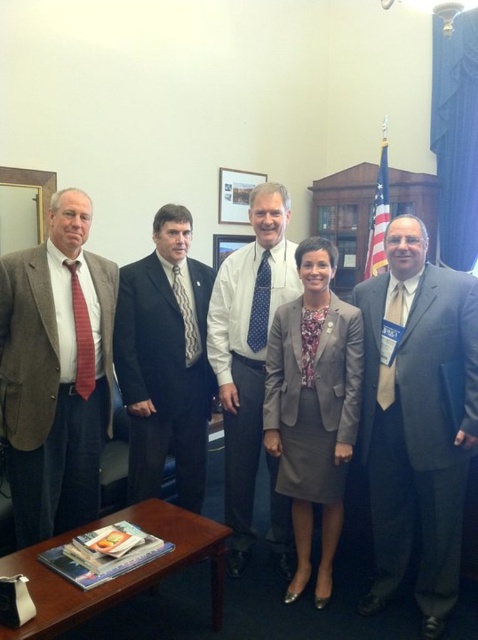
Is matte brown suit at left wider than dark gray suit at center?

Incorrect, matte brown suit at left's width does not surpass dark gray suit at center's.

Can you confirm if matte brown suit at left is positioned below dark gray suit at center?

No, matte brown suit at left is not below dark gray suit at center.

Which is in front, point (21, 305) or point (159, 284)?

Point (21, 305)

Locate an element on the screen. The width and height of the screenshot is (478, 640). matte brown suit at left is located at coordinates (55, 371).

Is point (25, 292) positioned before point (247, 275)?

Yes, point (25, 292) is closer to viewer.

Based on the photo, can you confirm if matte brown suit at left is bigger than blue dotted tie at center?

Actually, matte brown suit at left might be smaller than blue dotted tie at center.

The height and width of the screenshot is (640, 478). Describe the element at coordinates (55, 371) in the screenshot. I see `matte brown suit at left` at that location.

Image resolution: width=478 pixels, height=640 pixels. Find the location of `matte brown suit at left`. matte brown suit at left is located at coordinates 55,371.

Can you confirm if gray wool suit at right is taller than matte brown suit at left?

In fact, gray wool suit at right may be shorter than matte brown suit at left.

Which is behind, point (380, 502) or point (89, 442)?

Point (380, 502)

Find the location of a particular element. This screenshot has width=478, height=640. gray wool suit at right is located at coordinates (419, 426).